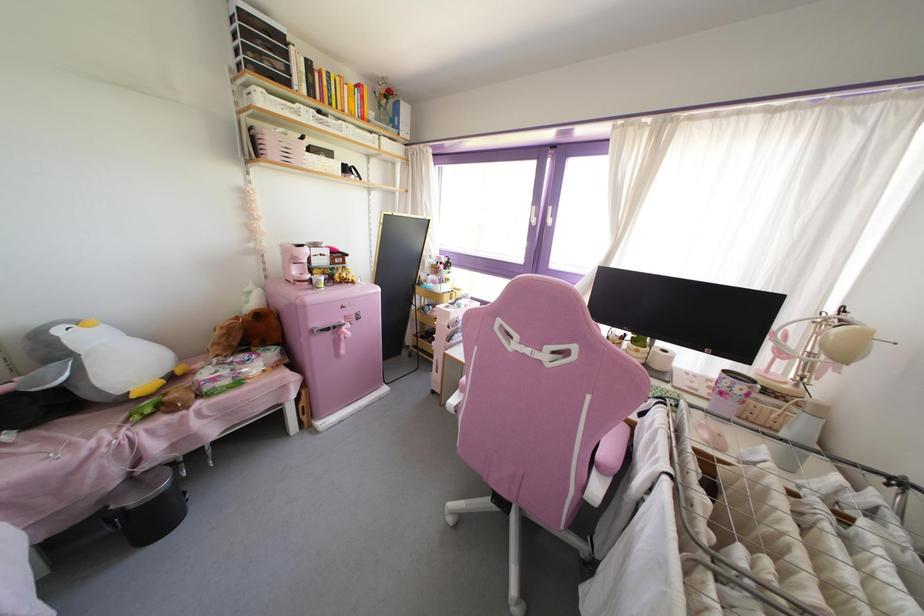
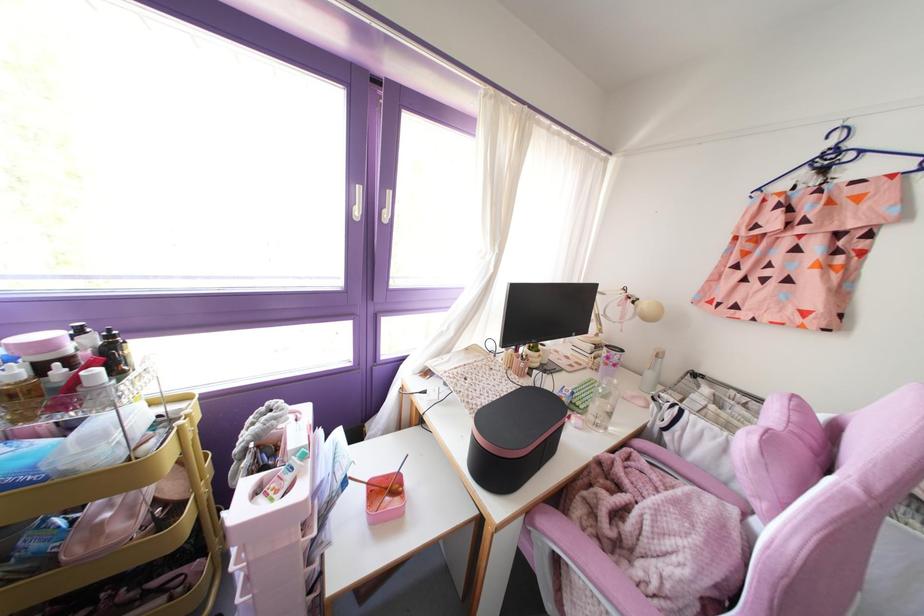
In the second image, find the point that corresponds to point 441,262 in the first image.

(67, 360)